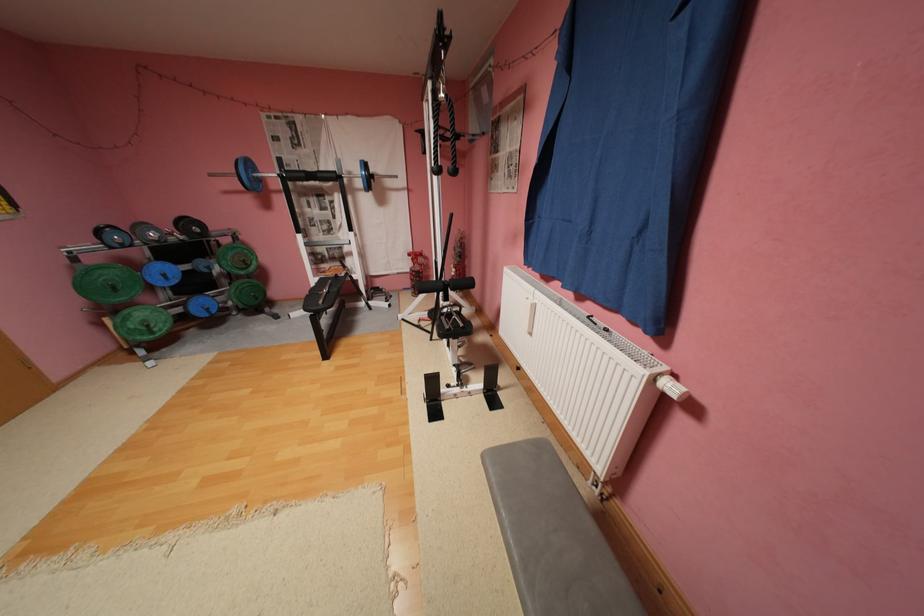
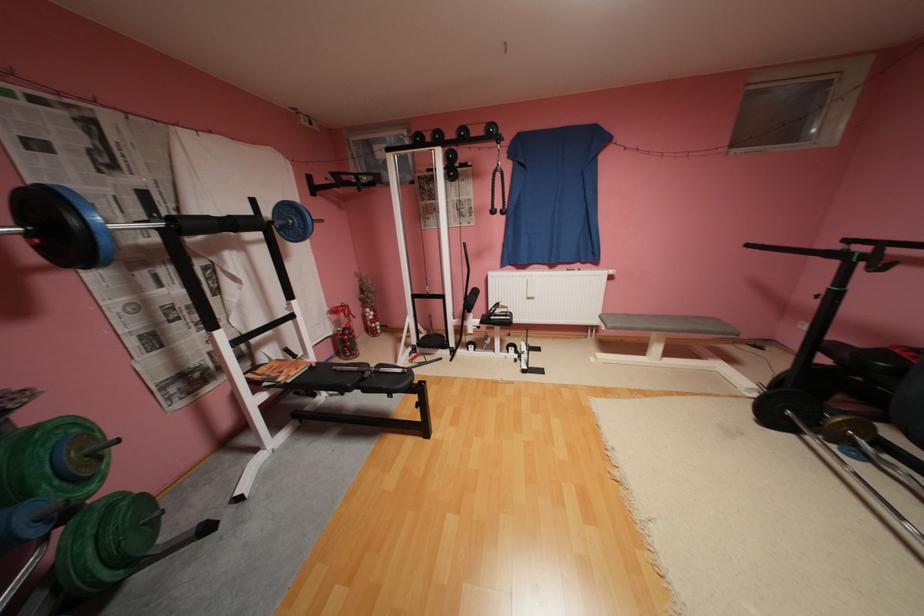
The point at (257, 265) is marked in the first image. Where is the corresponding point in the second image?

(111, 459)